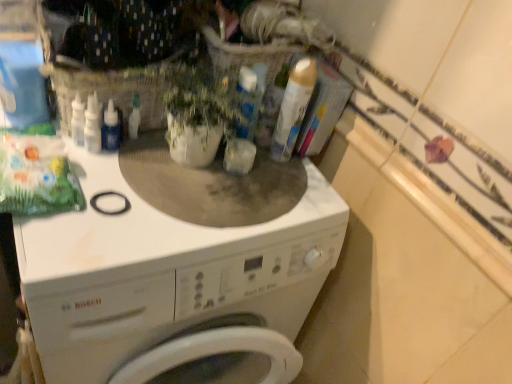
The image size is (512, 384). Describe the element at coordinates (111, 128) in the screenshot. I see `transparent plastic bottle at center` at that location.

The image size is (512, 384). What do you see at coordinates (198, 112) in the screenshot?
I see `green matte plant at center` at bounding box center [198, 112].

This screenshot has width=512, height=384. In order to click on gold metallic can at upper center in this screenshot , I will do `click(293, 109)`.

Is white glossy counter top at upper right shorter than white matte washing machine at center?

Correct, white glossy counter top at upper right is not as tall as white matte washing machine at center.

How many degrees apart are the facing directions of white glossy counter top at upper right and white matte washing machine at center?

The angle between the facing direction of white glossy counter top at upper right and the facing direction of white matte washing machine at center is 90 degrees.

From a real-world perspective, is white glossy counter top at upper right beneath white matte washing machine at center?

No, from a real-world perspective, white glossy counter top at upper right is not below white matte washing machine at center.

Between white glossy counter top at upper right and white matte washing machine at center, which one appears on the left side from the viewer's perspective?

From the viewer's perspective, white matte washing machine at center appears more on the left side.

From the image's perspective, does gold metallic can at upper center appear lower than white matte washing machine at center?

No, from the image's perspective, gold metallic can at upper center is not below white matte washing machine at center.

From their relative heights in the image, would you say gold metallic can at upper center is taller or shorter than white matte washing machine at center?

gold metallic can at upper center is shorter than white matte washing machine at center.

Which of these two, gold metallic can at upper center or white matte washing machine at center, is smaller?

With smaller size is gold metallic can at upper center.

Is the depth of gold metallic can at upper center greater than that of white matte washing machine at center?

Yes, gold metallic can at upper center is further from the viewer.

Considering the sizes of white matte washing machine at center and gold metallic can at upper center in the image, is white matte washing machine at center wider or thinner than gold metallic can at upper center?

Considering their sizes, white matte washing machine at center looks broader than gold metallic can at upper center.

The image size is (512, 384). What are the coordinates of `cleaning product behind the white matte washing machine at center` in the screenshot? It's located at (293, 109).

Which of these two, white matte washing machine at center or gold metallic can at upper center, is smaller?

gold metallic can at upper center.

From the image's perspective, between green matte plant at center and gold metallic can at upper center, who is located below?

green matte plant at center is shown below in the image.

Between green matte plant at center and gold metallic can at upper center, which one has smaller width?

With smaller width is gold metallic can at upper center.

I want to click on plant to the left of gold metallic can at upper center, so click(x=198, y=112).

Considering the positions of points (179, 81) and (293, 136), is point (179, 81) closer to camera compared to point (293, 136)?

That is True.

Based on their positions, is white matte washing machine at center located to the left or right of green matte plant at center?

Clearly, white matte washing machine at center is on the left of green matte plant at center in the image.

Is white matte washing machine at center positioned behind green matte plant at center?

No, white matte washing machine at center is closer to the camera.

From a real-world perspective, which object rests below the other?

From a 3D spatial view, white matte washing machine at center is below.

In the scene shown: Is white matte washing machine at center far away from green matte plant at center?

No, there isn't a large distance between white matte washing machine at center and green matte plant at center.

Between gold metallic can at upper center and white glossy counter top at upper right, which one has smaller width?

white glossy counter top at upper right.

How different are the orientations of gold metallic can at upper center and white glossy counter top at upper right in degrees?

The facing directions of gold metallic can at upper center and white glossy counter top at upper right are 90 degrees apart.

Measure the distance from gold metallic can at upper center to white glossy counter top at upper right.

A distance of 12.64 inches exists between gold metallic can at upper center and white glossy counter top at upper right.

Between gold metallic can at upper center and white glossy counter top at upper right, which one appears on the left side from the viewer's perspective?

Positioned to the left is gold metallic can at upper center.

Considering the sizes of objects green matte plant at center and transparent plastic bottle at center in the image provided, who is smaller, green matte plant at center or transparent plastic bottle at center?

With smaller size is transparent plastic bottle at center.

Would you say green matte plant at center is to the left or to the right of transparent plastic bottle at center in the picture?

green matte plant at center is to the right of transparent plastic bottle at center.

In the scene shown: Does green matte plant at center turn towards transparent plastic bottle at center?

No, green matte plant at center is not oriented towards transparent plastic bottle at center.

Identify the location of counter top behind the white matte washing machine at center. This screenshot has height=384, width=512. (418, 272).

This screenshot has width=512, height=384. In order to click on washing machine below the gold metallic can at upper center (from the image's perspective) in this screenshot , I will do `click(177, 268)`.

Which object lies nearer to the anchor point white glossy counter top at upper right, green matte plant at center or transparent plastic bottle at center?

green matte plant at center is closer to white glossy counter top at upper right.

Based on their spatial positions, is white glossy counter top at upper right or white matte washing machine at center closer to transparent plastic bottle at center?

white matte washing machine at center lies closer to transparent plastic bottle at center than the other object.

When comparing their distances from white glossy counter top at upper right, does white matte washing machine at center or transparent plastic bottle at center seem further?

The object further to white glossy counter top at upper right is transparent plastic bottle at center.

Looking at the image, which one is located further to gold metallic can at upper center, green matte plant at center or white matte washing machine at center?

The object further to gold metallic can at upper center is white matte washing machine at center.

In the scene shown: Estimate the real-world distances between objects in this image. Which object is further from white matte washing machine at center, gold metallic can at upper center or transparent plastic bottle at center?

Based on the image, transparent plastic bottle at center appears to be further to white matte washing machine at center.

From the image, which object appears to be nearer to gold metallic can at upper center, white glossy counter top at upper right or transparent plastic bottle at center?

Among the two, white glossy counter top at upper right is located nearer to gold metallic can at upper center.

Considering their positions, is transparent plastic bottle at center positioned further to gold metallic can at upper center than white glossy counter top at upper right?

transparent plastic bottle at center is positioned further to the anchor gold metallic can at upper center.

When comparing their distances from green matte plant at center, does gold metallic can at upper center or white glossy counter top at upper right seem further?

The object further to green matte plant at center is white glossy counter top at upper right.

Locate an element on the screen. The image size is (512, 384). bottle between gold metallic can at upper center and white matte washing machine at center vertically is located at coordinates (111, 128).

This screenshot has width=512, height=384. Identify the location of plant situated between white matte washing machine at center and white glossy counter top at upper right from left to right. (198, 112).

You are a GUI agent. You are given a task and a screenshot of the screen. Output one action in this format:
    pyautogui.click(x=<x>, y=<y>)
    Task: Click on the plant between transparent plastic bottle at center and gold metallic can at upper center from left to right
    This screenshot has height=384, width=512.
    Given the screenshot: What is the action you would take?
    pyautogui.click(x=198, y=112)

Where is `washing machine between transparent plastic bottle at center and white glossy counter top at upper right in the horizontal direction`? washing machine between transparent plastic bottle at center and white glossy counter top at upper right in the horizontal direction is located at coordinates (177, 268).